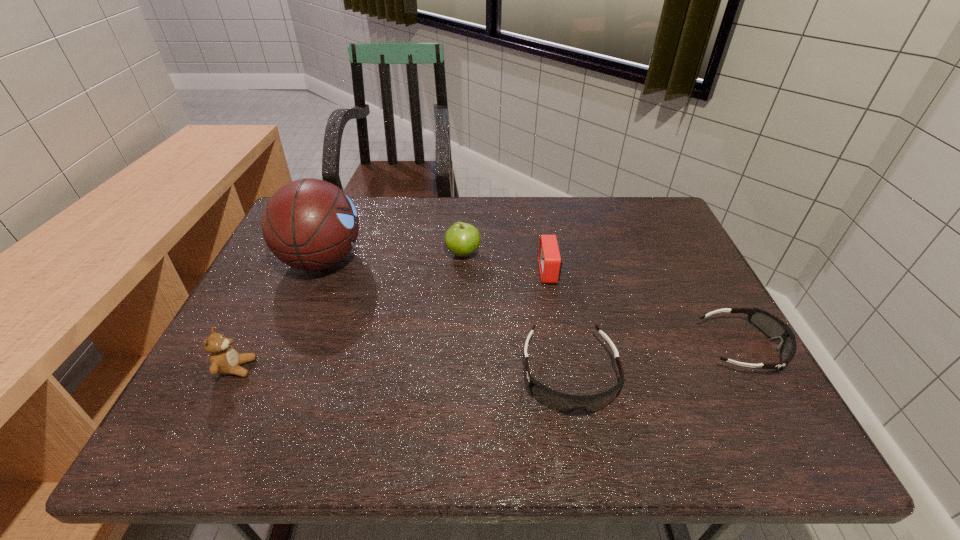
At what (x,y) coordinates should I click in order to perform the action: click on free space between the teddy bear and the third object from left to right. Please return your answer as a coordinate pair (x, y). This screenshot has width=960, height=540. Looking at the image, I should click on (350, 310).

At what (x,y) coordinates should I click in order to perform the action: click on vacant area that lies between the teddy bear and the shorter goggles. Please return your answer as a coordinate pair (x, y). Looking at the image, I should click on (490, 357).

At what (x,y) coordinates should I click in order to perform the action: click on empty space that is in between the left goggles and the teddy bear. Please return your answer as a coordinate pair (x, y). Image resolution: width=960 pixels, height=540 pixels. Looking at the image, I should click on (403, 372).

Where is `free space between the basketball and the third shortest object`? This screenshot has height=540, width=960. free space between the basketball and the third shortest object is located at coordinates (436, 266).

You are a GUI agent. You are given a task and a screenshot of the screen. Output one action in this format:
    pyautogui.click(x=<x>, y=<y>)
    Task: Click on the free space between the rightmost object and the third object from left to right
    The width and height of the screenshot is (960, 540).
    Given the screenshot: What is the action you would take?
    tap(603, 300)

Where is `free area in between the alarm clock and the left goggles`? This screenshot has height=540, width=960. free area in between the alarm clock and the left goggles is located at coordinates (560, 323).

Find the location of a particular element. the fourth closest object to the apple is located at coordinates (224, 359).

Choose which object is the fifth nearest neighbor to the taller goggles. Please provide its 2D coordinates. Your answer should be formatted as a tuple, i.e. [(x, y)], where the tuple contains the x and y coordinates of a point satisfying the conditions above.

[(224, 359)]